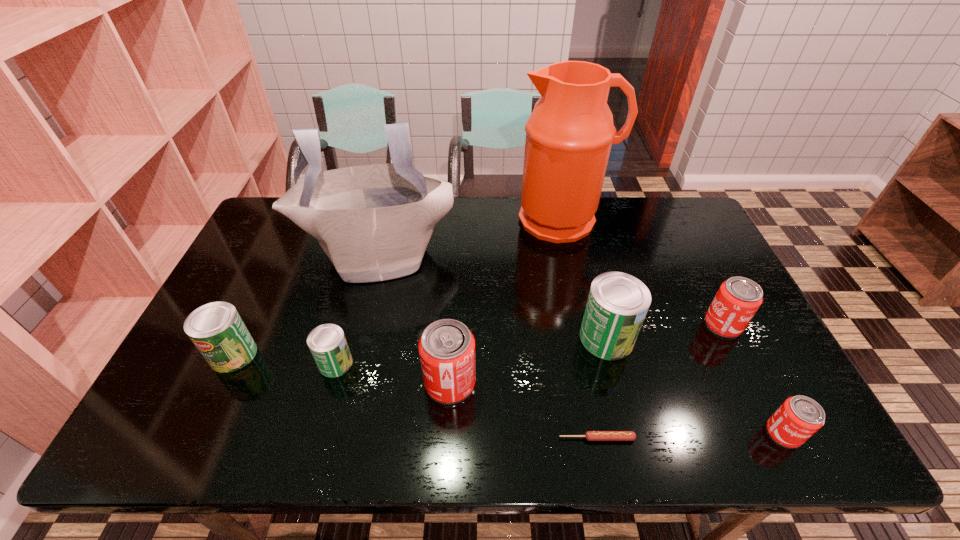
Where is `free space between the second smallest red can and the nearest can`? The height and width of the screenshot is (540, 960). free space between the second smallest red can and the nearest can is located at coordinates (753, 379).

You are a GUI agent. You are given a task and a screenshot of the screen. Output one action in this format:
    pyautogui.click(x=<x>, y=<y>)
    Task: Click on the unoccupied position between the shopping bag and the nearest can
    This screenshot has height=540, width=960.
    Given the screenshot: What is the action you would take?
    pyautogui.click(x=581, y=343)

In order to click on vacant space that's between the fourth can from left to right and the smallest red can in this screenshot , I will do `click(695, 386)`.

The image size is (960, 540). In order to click on unoccupied area between the orange water jug and the nearest red can in this screenshot , I will do `click(673, 326)`.

At what (x,y) coordinates should I click in order to perform the action: click on blank region between the smallest red can and the second biggest red can. Please return your answer as a coordinate pair (x, y). Looking at the image, I should click on [753, 379].

The height and width of the screenshot is (540, 960). I want to click on object that can be found as the third closest to the leftmost can, so click(446, 348).

Identify which object is the second closest to the fifth can from right to left. Please provide its 2D coordinates. Your answer should be formatted as a tuple, i.e. [(x, y)], where the tuple contains the x and y coordinates of a point satisfying the conditions above.

[(446, 348)]

Identify the location of the fifth closest can to the nearest can. This screenshot has width=960, height=540. (216, 329).

Select which can appears as the second closest to the third can from right to left. Please provide its 2D coordinates. Your answer should be formatted as a tuple, i.e. [(x, y)], where the tuple contains the x and y coordinates of a point satisfying the conditions above.

[(446, 348)]

This screenshot has height=540, width=960. I want to click on the closest red can relative to the leftmost object, so click(x=446, y=348).